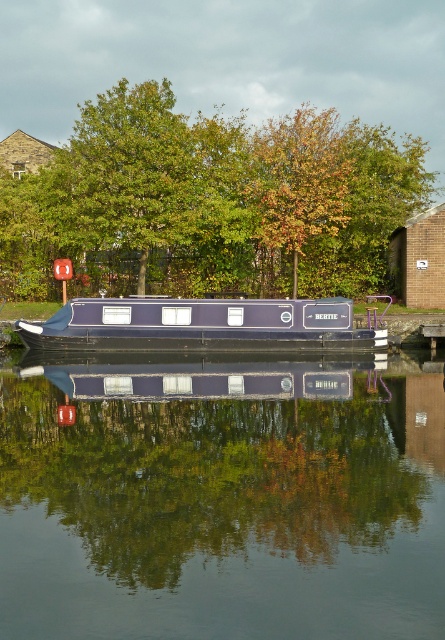
You are standing on the dock and see the glossy dark blue boat at center and the green leafy tree at center. Which object is closer to you?

The glossy dark blue boat at center is closer to you because it is in front of the green leafy tree at center.

You are standing on the deck of the narrowboat BERTIE and looking out at the waterway. You notice two points marked on the water surface. The first point is located at coordinates point (177, 173) and the second point is at point (32, 337). Which of these two points is closer to you, the observer, on the water surface?

Point (177, 173) is further to the camera than point (32, 337), so the point closer to you is point (32, 337).

You are standing on the narrowboat BERTIE and want to move from the point at coordinates point (44, 474) to the point at coordinates point (93, 196). Which direction should you move to reach your destination?

You should move backward to reach the point at coordinates point (93, 196) because point (44, 474) is in front of it.